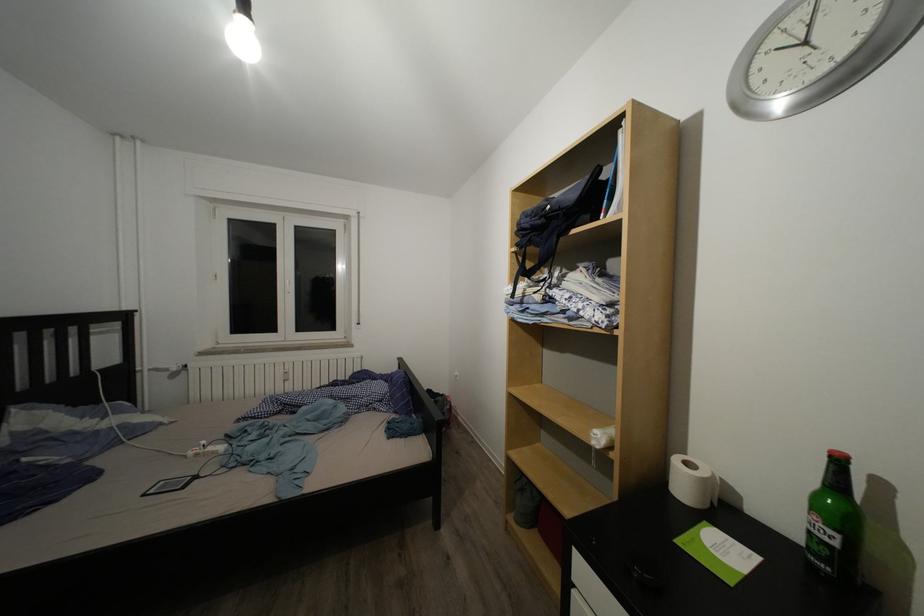
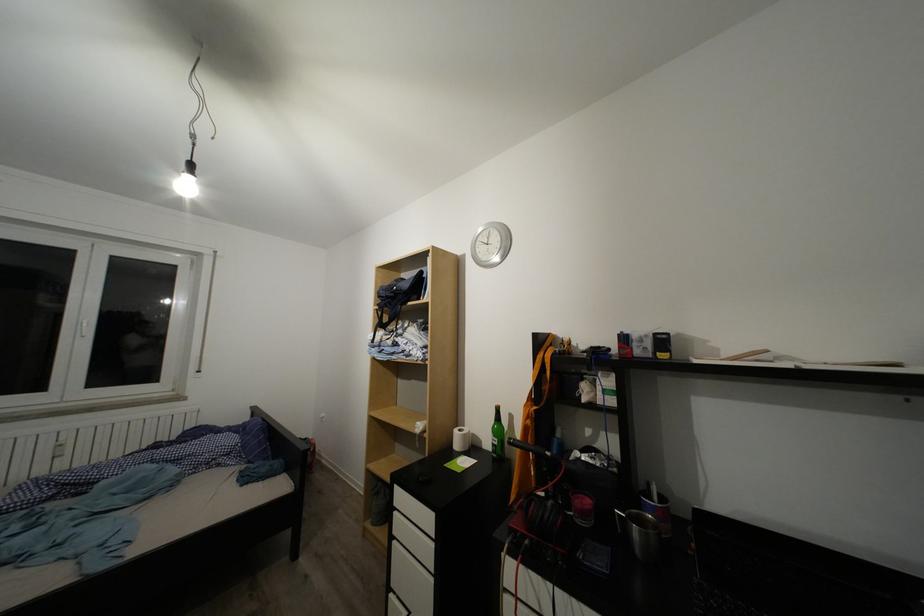
Question: The camera is either moving clockwise (left) or counter-clockwise (right) around the object. The first image is from the beginning of the video and the second image is from the end. Is the camera moving left or right when shooting the video?

Choices:
 (A) Left
 (B) Right

Answer: (A)